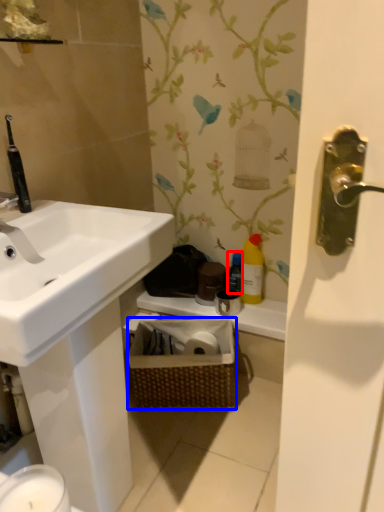
Question: Among these objects, which one is farthest to the camera, bottle (highlighted by a red box) or basket (highlighted by a blue box)?

Choices:
 (A) bottle
 (B) basket

Answer: (A)